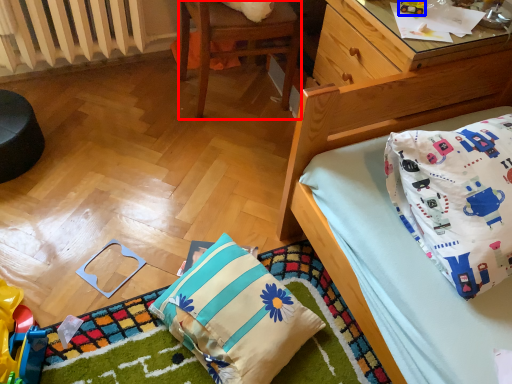
Question: Which of the following is the closest to the observer, chair (highlighted by a red box) or toy (highlighted by a blue box)?

Choices:
 (A) chair
 (B) toy

Answer: (B)